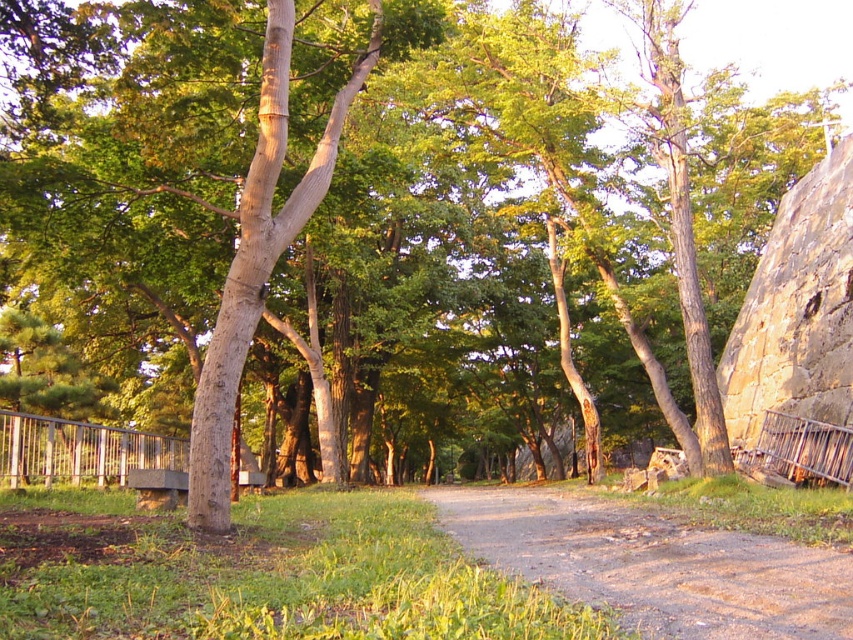
Question: Is brown gravel path at center thinner than silver metallic rail at lower left?

Choices:
 (A) no
 (B) yes

Answer: (A)

Question: In this image, where is brown gravel path at center located relative to rusty metal fence at right?

Choices:
 (A) above
 (B) below

Answer: (B)

Question: Observing the image, what is the correct spatial positioning of brown gravel path at center in reference to rusty metal fence at right?

Choices:
 (A) below
 (B) above

Answer: (A)

Question: Estimate the real-world distances between objects in this image. Which object is closer to the metallic silver rail at right?

Choices:
 (A) silver metallic rail at lower left
 (B) brown gravel path at center
 (C) rusty metal fence at right

Answer: (C)

Question: Based on their relative distances, which object is nearer to the brown gravel path at center?

Choices:
 (A) silver metallic rail at lower left
 (B) rusty metal fence at right

Answer: (B)

Question: Among these points, which one is farthest from the camera?

Choices:
 (A) (805, 276)
 (B) (70, 449)

Answer: (A)